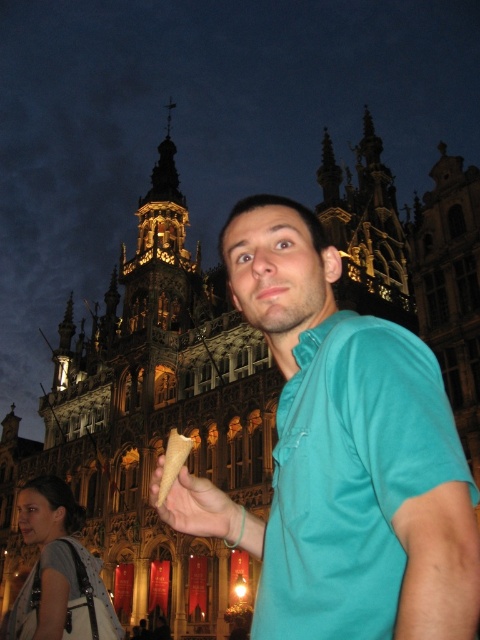
Question: Can you confirm if teal fabric shirt at center is positioned above smooth beige cone at center?

Choices:
 (A) yes
 (B) no

Answer: (A)

Question: Which object is farther from the camera taking this photo?

Choices:
 (A) golden waffle cone at center
 (B) teal fabric shirt at center
 (C) smooth beige cone at center

Answer: (C)

Question: Which of the following is the closest to the observer?

Choices:
 (A) smooth beige cone at center
 (B) teal fabric shirt at center
 (C) golden waffle cone at center

Answer: (B)

Question: From the image, what is the correct spatial relationship of smooth beige cone at center in relation to golden waffle cone at center?

Choices:
 (A) above
 (B) below

Answer: (B)

Question: Considering the real-world distances, which object is farthest from the golden waffle cone at center?

Choices:
 (A) teal fabric shirt at center
 (B) smooth beige cone at center

Answer: (A)

Question: Considering the relative positions of smooth beige cone at center and golden waffle cone at center in the image provided, where is smooth beige cone at center located with respect to golden waffle cone at center?

Choices:
 (A) left
 (B) right

Answer: (A)